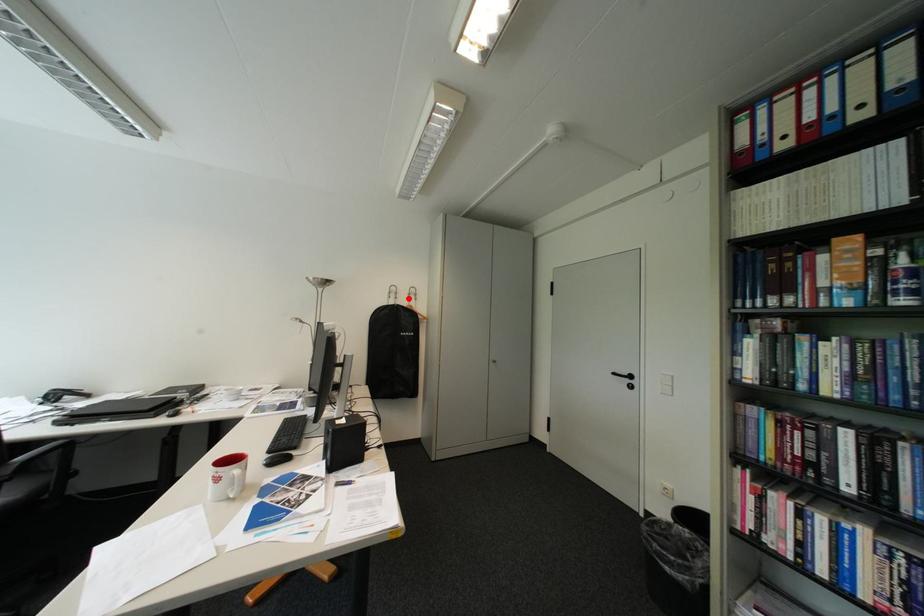
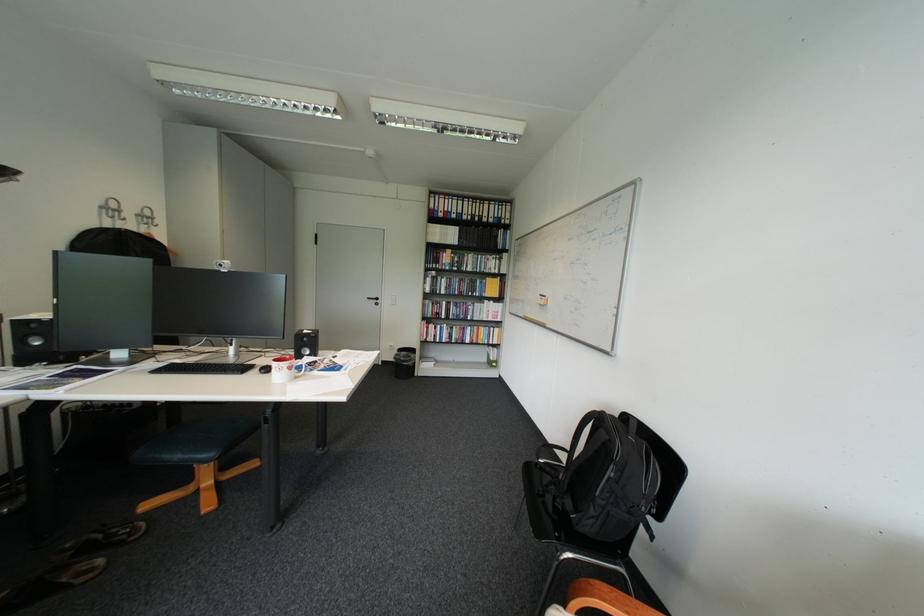
Find the pixel in the second image that matches the highlighted location in the first image.

(137, 220)